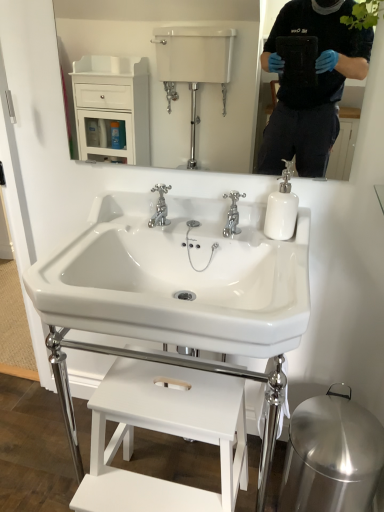
Find the location of `free location above white matte stool at lower center (from a real-world perspective)`. free location above white matte stool at lower center (from a real-world perspective) is located at coordinates (161, 392).